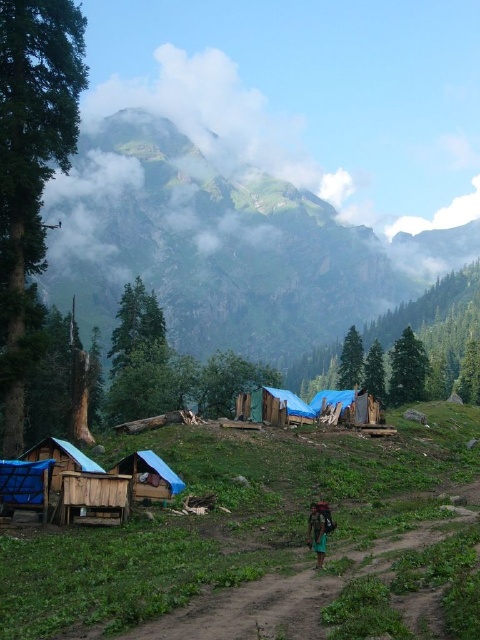
Question: Which object is farther from the camera taking this photo?

Choices:
 (A) blue tarpaulin tent at center
 (B) blue tarpaulin tent at lower center
 (C) wooden hut at lower left

Answer: (A)

Question: Which object is the closest to the blue tarpaulin tent at center?

Choices:
 (A) green fabric bag at lower center
 (B) blue tarpaulin tent at lower center

Answer: (B)

Question: Is blue tarpaulin tent at lower center above green fabric bag at lower center?

Choices:
 (A) no
 (B) yes

Answer: (A)

Question: Can you confirm if blue tarpaulin tent at center is thinner than green fabric bag at lower center?

Choices:
 (A) yes
 (B) no

Answer: (B)

Question: Among these points, which one is nearest to the camera?

Choices:
 (A) (208, 200)
 (B) (93, 513)
 (C) (144, 474)

Answer: (B)

Question: Does wooden hut at lower left have a larger size compared to blue tarpaulin tent at lower center?

Choices:
 (A) no
 (B) yes

Answer: (A)